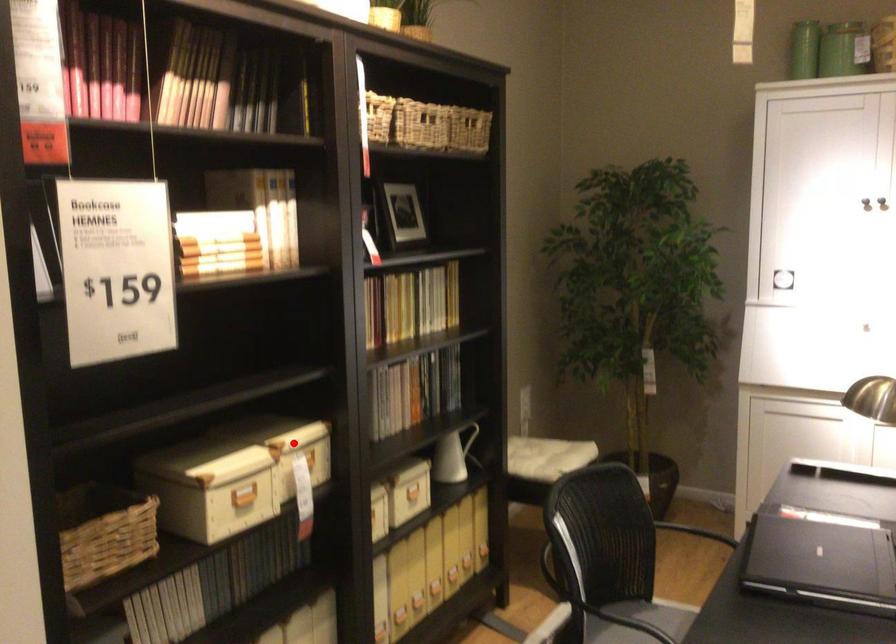
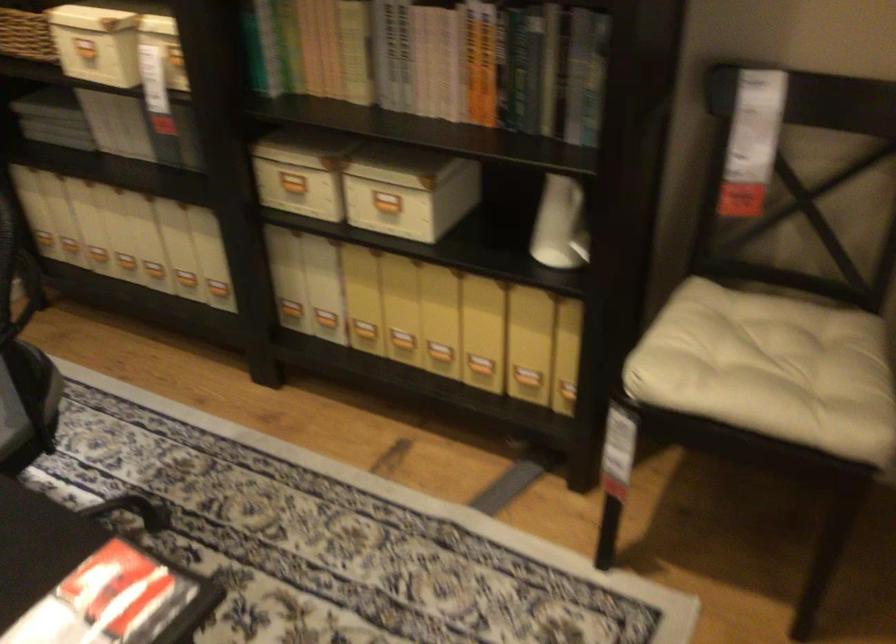
Find the pixel in the second image that matches the highlighted location in the first image.

(268, 46)